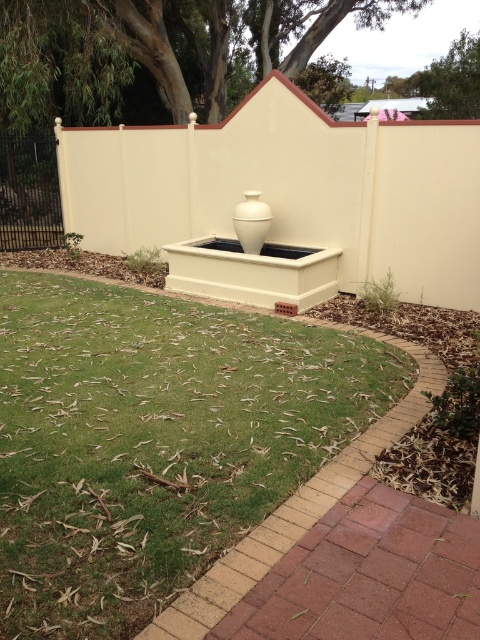
Who is positioned more to the right, black metal fence at left or white glossy vase at center?

white glossy vase at center

Who is more forward, (41, 225) or (243, 195)?

Point (243, 195) is in front.

At what (x,y) coordinates should I click in order to perform the action: click on black metal fence at left. Please return your answer as a coordinate pair (x, y). The width and height of the screenshot is (480, 640). Looking at the image, I should click on (28, 192).

Is brick at lower right to the left of black metal fence at left from the viewer's perspective?

No, brick at lower right is not to the left of black metal fence at left.

Is point (419, 364) more distant than point (39, 154)?

That is False.

Between point (436, 378) and point (26, 140), which one is positioned behind?

The point (26, 140) is more distant.

Find the location of a particular element. The height and width of the screenshot is (640, 480). brick at lower right is located at coordinates (298, 504).

Does brick at lower right have a smaller size compared to white glossy vase at center?

Incorrect, brick at lower right is not smaller in size than white glossy vase at center.

Based on the photo, who is more forward, (x=396, y=340) or (x=255, y=224)?

Point (x=396, y=340)

Locate an element on the screen. This screenshot has width=480, height=640. brick at lower right is located at coordinates pos(298,504).